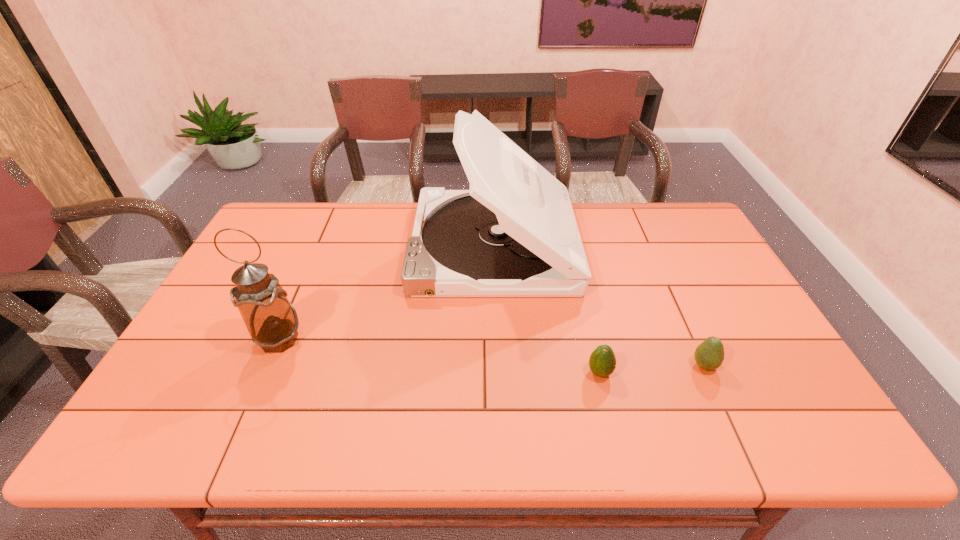
Where is `free space between the CD player and the left avocado`? Image resolution: width=960 pixels, height=540 pixels. free space between the CD player and the left avocado is located at coordinates (546, 309).

Identify the location of empty space between the leftmost object and the rightmost object. This screenshot has height=540, width=960. (492, 352).

This screenshot has width=960, height=540. In order to click on unoccupied position between the farthest object and the left avocado in this screenshot , I will do `click(546, 309)`.

The image size is (960, 540). In order to click on blank region between the CD player and the left avocado in this screenshot , I will do `click(546, 309)`.

What are the coordinates of `vacant space in between the leftmost object and the rightmost object` in the screenshot? It's located at (492, 352).

I want to click on vacant area that lies between the left avocado and the CD player, so click(x=546, y=309).

The height and width of the screenshot is (540, 960). In order to click on vacant area between the left avocado and the rightmost object in this screenshot , I will do `click(652, 369)`.

The image size is (960, 540). Identify the location of object that is the second closest one to the left avocado. (513, 234).

Identify the location of object that can be found as the third closest to the left avocado. (272, 322).

Find the location of a particular element. The height and width of the screenshot is (540, 960). vacant space that satisfies the following two spatial constraints: 1. on the control panel of the left avocado; 2. on the left side of the CD player is located at coordinates (497, 373).